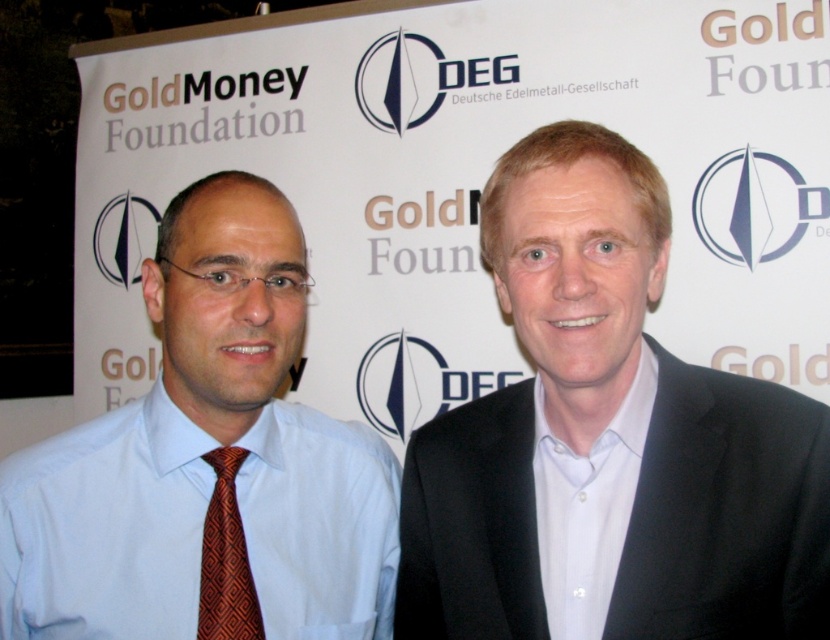
Please provide the 2D coordinates of the black matte suit at right in the image. The coordinates should be in the format of a tuple with two decimal numbers between 0 and 1, where the first number represents the horizontal position and the second the vertical position. The origin is at the bottom left corner of the image.

The 2D coordinates of the black matte suit at right are at point (608, 442).

You are attending a virtual meeting and see the image. The organizer asks you to describe the spatial relationship between the black matte suit at right and the orange patterned tie at left. How would you describe it?

The black matte suit at right is above the orange patterned tie at left.

You are attending a financial conference and see two people in front of a GoldMoney Foundation backdrop. You notice a matte blue shirt at center and an orange patterned tie at left. Which clothing item is located to the left of the other?

The matte blue shirt at center is positioned on the left side of orange patterned tie at left, so the matte blue shirt at center is to the left of the orange patterned tie at left.